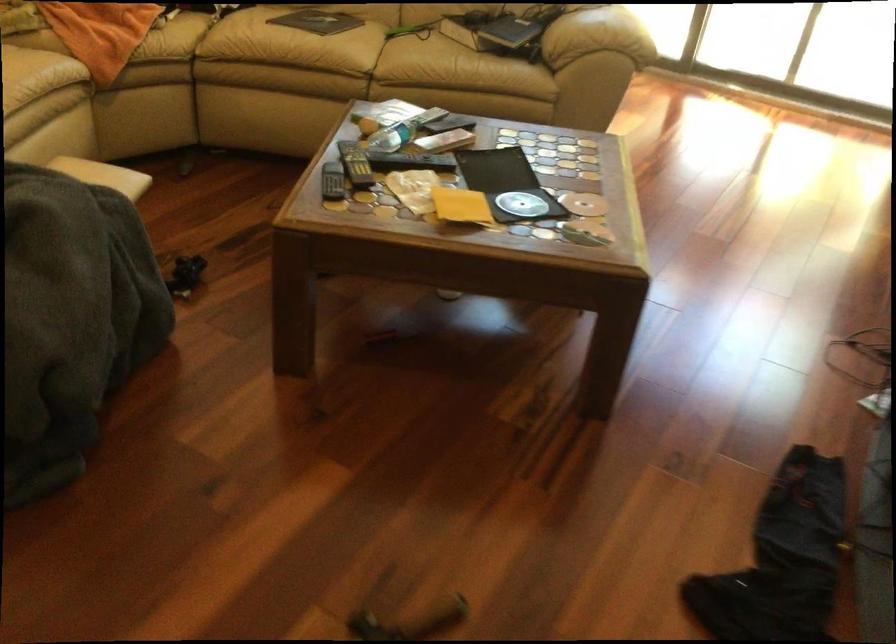
The location [467,29] corresponds to which object?

It corresponds to the black book in the image.